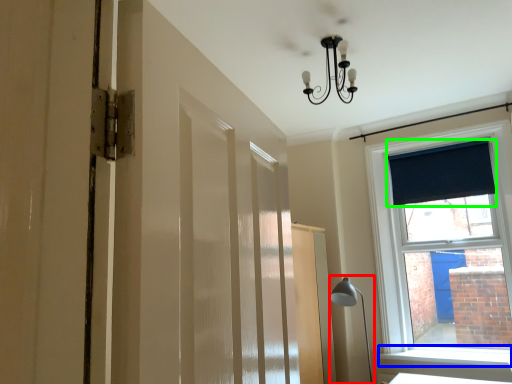
Question: Which object is the farthest from table lamp (highlighted by a red box)? Choose among these: window sill (highlighted by a blue box) or curtain (highlighted by a green box).

Choices:
 (A) window sill
 (B) curtain

Answer: (B)